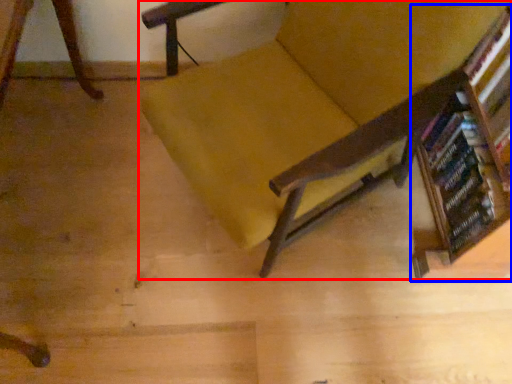
Question: Which object is closer to the camera taking this photo, chair (highlighted by a red box) or bookcase (highlighted by a blue box)?

Choices:
 (A) chair
 (B) bookcase

Answer: (A)